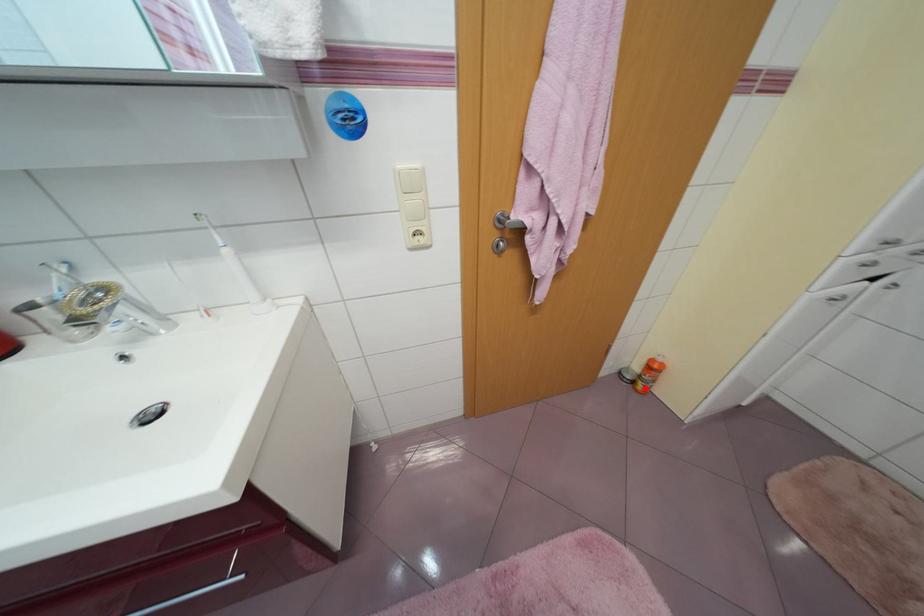
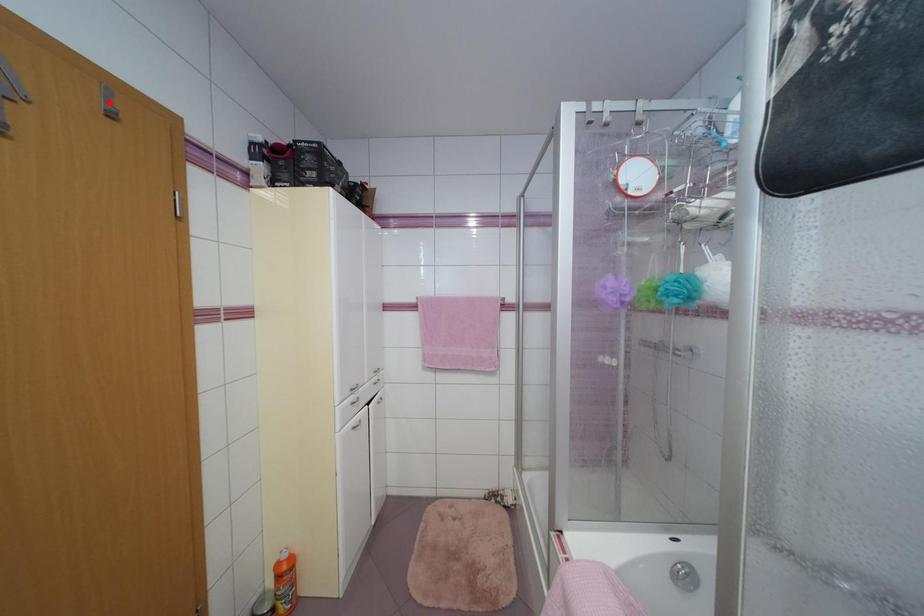
I am providing you with two images of the same scene from different viewpoints. A red point is marked on the first image and another point is marked on the second image. Do the highlighted points in image1 and image2 indicate the same real-world spot?

No